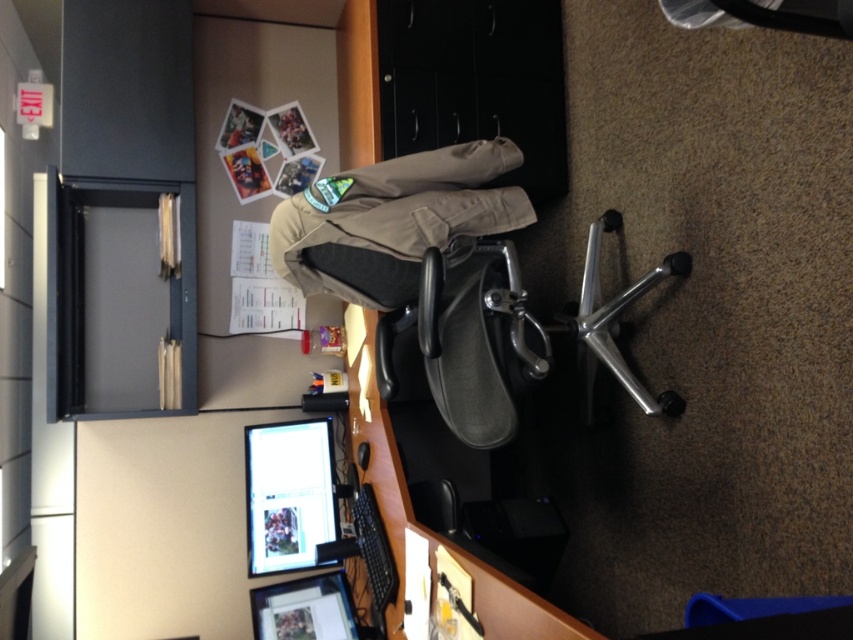
You are organizing the office and need to place a new item between the khaki cotton pants at center and the matte black monitor at lower left. Based on their positions, which object should the new item be placed closer to?

The new item should be placed closer to the matte black monitor at lower left because the khaki cotton pants at center is closer to the viewer than the matte black monitor at lower left, meaning the monitor is farther back. To place the item between them, it should be positioned closer to the monitor to maintain the spatial relationship.

You are a delivery person who needs to place a package between the khaki cotton pants at center and the matte black monitor at lower left. The package is 36 inches long. Can it fit between them?

The khaki cotton pants at center and matte black monitor at lower left are 37.69 inches apart from each other. The package is 36 inches long, so it can fit between them with about 1.69 inches of space remaining.